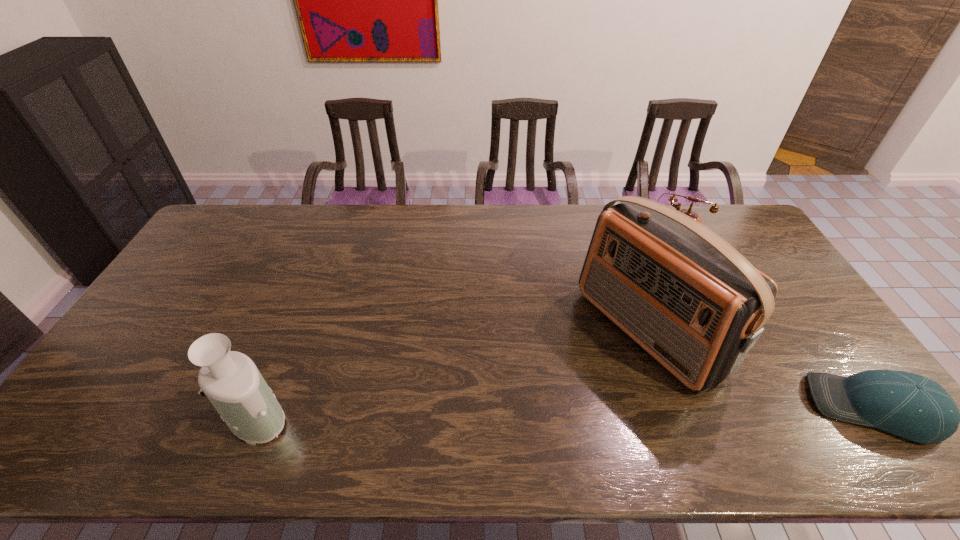
Where is `free space between the second tallest object and the radio receiver`? This screenshot has width=960, height=540. free space between the second tallest object and the radio receiver is located at coordinates (451, 373).

Select which object is the second closest to the third tallest object. Please provide its 2D coordinates. Your answer should be formatted as a tuple, i.e. [(x, y)], where the tuple contains the x and y coordinates of a point satisfying the conditions above.

[(908, 405)]

Identify the location of the third closest object relative to the tallest object. The image size is (960, 540). (231, 381).

I want to click on vacant point that satisfies the following two spatial constraints: 1. on the back side of the third shortest object; 2. on the right side of the tallest object, so click(x=290, y=330).